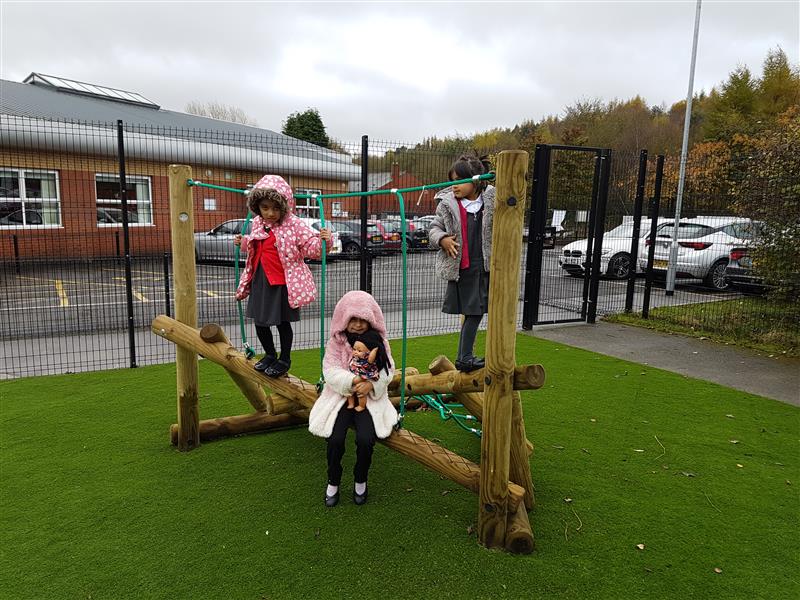
Locate an element on the screen. doll is located at coordinates (360, 349).